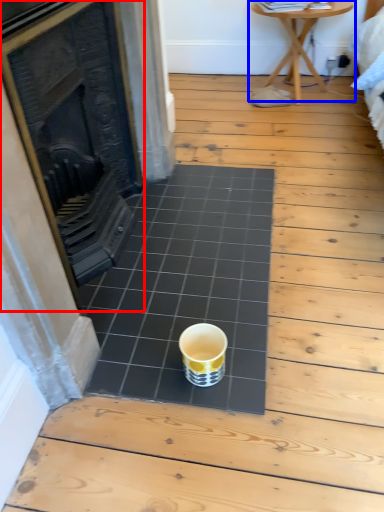
Question: Which object is further to the camera taking this photo, fireplace (highlighted by a red box) or table (highlighted by a blue box)?

Choices:
 (A) fireplace
 (B) table

Answer: (B)